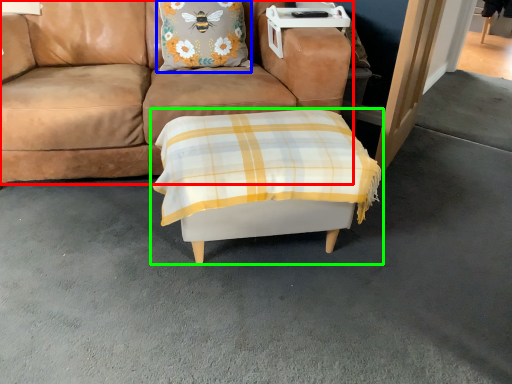
Question: Which object is the closest to the studio couch (highlighted by a red box)? Choose among these: pillow (highlighted by a blue box) or table (highlighted by a green box).

Choices:
 (A) pillow
 (B) table

Answer: (A)